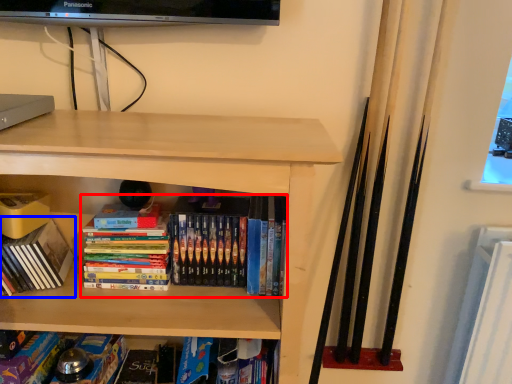
Question: Which point is closer to the camera, book (highlighted by a red box) or book (highlighted by a blue box)?

Choices:
 (A) book
 (B) book

Answer: (B)